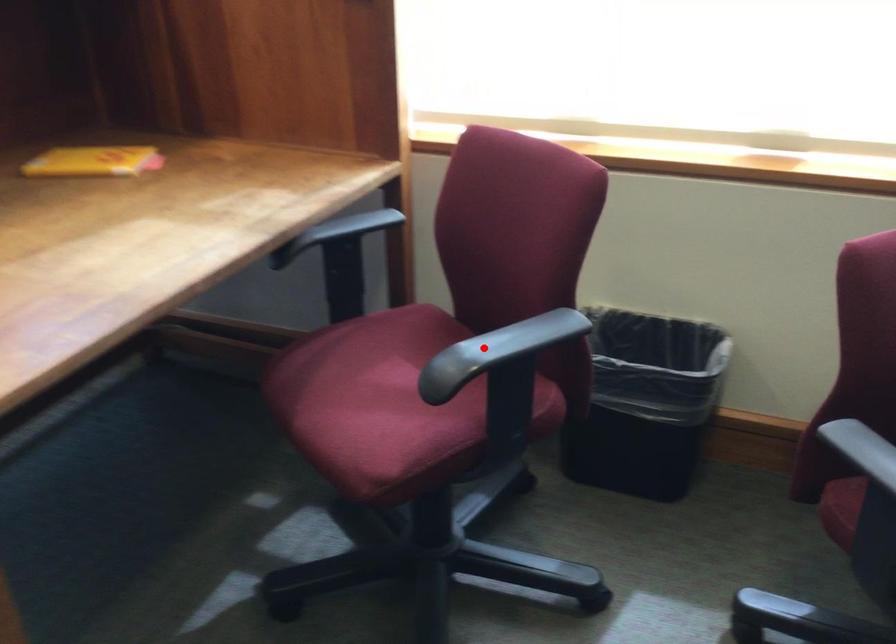
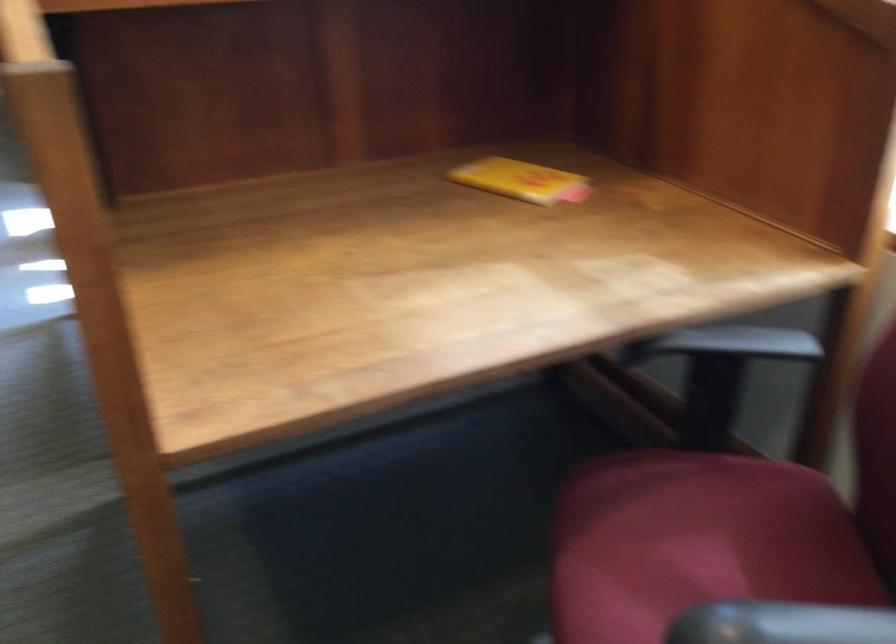
Question: I am providing you with two images of the same scene from different viewpoints. A red point is shown in image1. For the corresponding object point in image2, is it positioned nearer or farther from the camera?

Choices:
 (A) Nearer
 (B) Farther

Answer: (A)